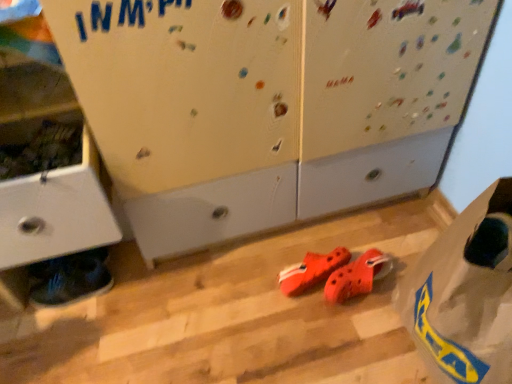
Find the location of a particular element. The height and width of the screenshot is (384, 512). free space to the right of shiny blue sneakers at lower left, which appears as the third footwear when viewed from the right is located at coordinates (136, 292).